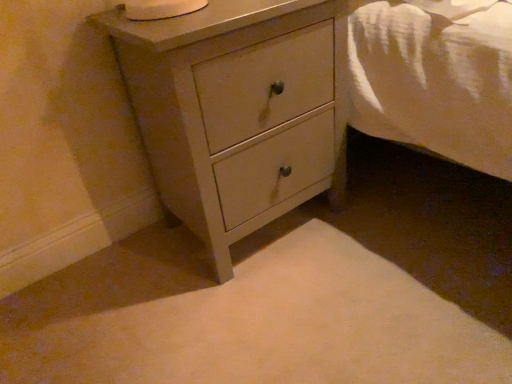
I want to click on matte gray chest of drawers at lower left, so click(237, 110).

Looking at this image, measure the distance between matte gray chest of drawers at lower left and camera.

30.53 inches.

Image resolution: width=512 pixels, height=384 pixels. What do you see at coordinates (237, 110) in the screenshot?
I see `matte gray chest of drawers at lower left` at bounding box center [237, 110].

Identify the location of matte gray chest of drawers at lower left. (237, 110).